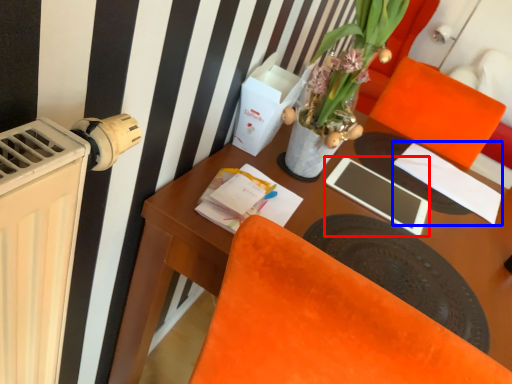
Question: Which point is further to the camera, tablet computer (highlighted by a red box) or notepad (highlighted by a blue box)?

Choices:
 (A) tablet computer
 (B) notepad

Answer: (B)